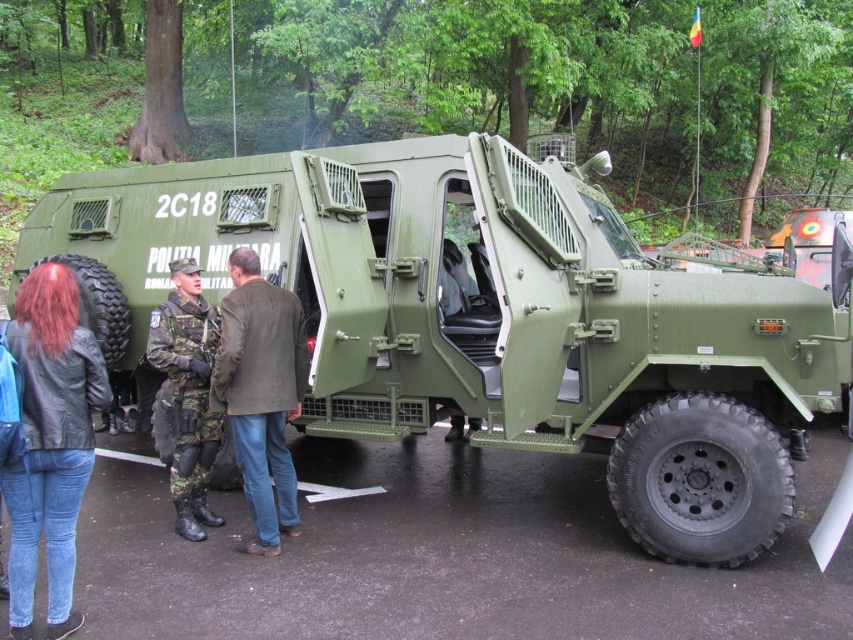
You are a photographer trying to capture a clear shot of the matte green armored vehicle at center. You notice a point at coordinates (x=491, y=316). Where is this point located in relation to the matte green armored vehicle at center?

The point at coordinates (x=491, y=316) indicates the exact location of the matte green armored vehicle at center.

You are a photographer standing in front of the matte green armored vehicle at center. You want to take a closeup photo of the vehicle without moving closer than 4 meters. Is your current position sufficient for a clear closeup?

The matte green armored vehicle at center is 4.40 meters away from the camera. Since you are standing at least 4 meters away, your current position is sufficient for a clear closeup photo as the distance is within the required range.

You are a photographer positioned at the front of the APC. You need to take a photo that includes both the black leather jacket at lower left and the brown leather jacket at center. Which jacket should you pan your camera to the right to include in the frame?

To include both the black leather jacket at lower left and the brown leather jacket at center in the frame, you should pan your camera to the right towards the brown leather jacket at center since the black leather jacket at lower left is already positioned to the left of it.